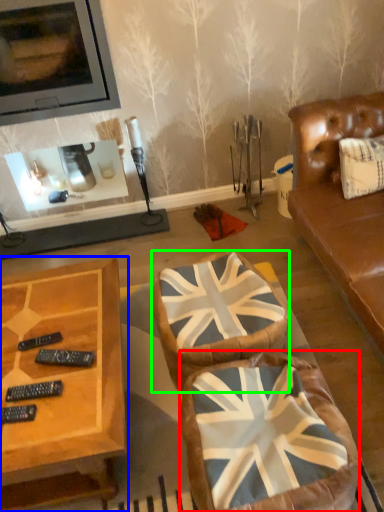
Question: Estimate the real-world distances between objects in this image. Which object is closer to swivel chair (highlighted by a red box), coffee table (highlighted by a blue box) or swivel chair (highlighted by a green box)?

Choices:
 (A) coffee table
 (B) swivel chair

Answer: (B)